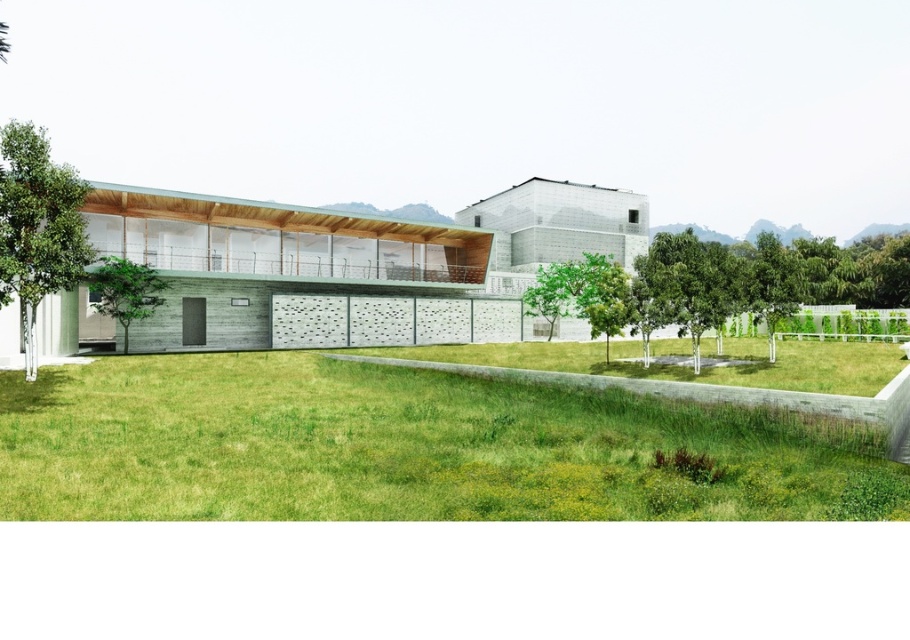
You are a landscape architect designing a walking path between the green grass at lower center and the green textured tree at left. The path must be 15 meters long. Can you create a path that reaches the tree without exceeding the required length?

The distance between the green grass at lower center and the green textured tree at left is 14.69 meters, which is shorter than the required 15 meters. Therefore, the path can be created to reach the tree without exceeding the required length.

You are standing in front of the modern architectural structure and want to walk towards the green textured tree at left. Which direction should you move relative to the green grass at lower center?

You should move towards the left relative to the green grass at lower center because the green textured tree at left is located to the left side of the scene, while the green grass at lower center is closer to you.